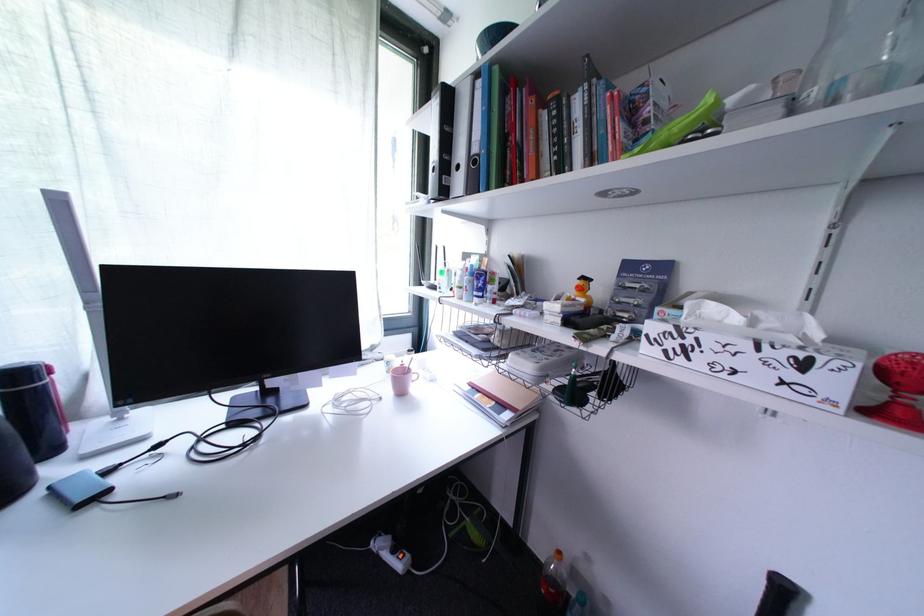
You are a GUI agent. You are given a task and a screenshot of the screen. Output one action in this format:
    pyautogui.click(x=<x>, y=<y>)
    Task: Click on the orange bottle cap
    The image size is (924, 616).
    Given the screenshot: What is the action you would take?
    pyautogui.click(x=558, y=556)